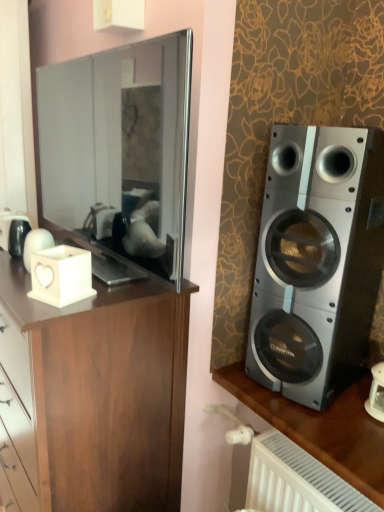
Question: From a real-world perspective, is matte black mirror at left under silver metallic speaker at right?

Choices:
 (A) yes
 (B) no

Answer: (B)

Question: Is matte black mirror at left thinner than silver metallic speaker at right?

Choices:
 (A) no
 (B) yes

Answer: (B)

Question: Considering the relative sizes of matte black mirror at left and silver metallic speaker at right in the image provided, is matte black mirror at left wider than silver metallic speaker at right?

Choices:
 (A) no
 (B) yes

Answer: (A)

Question: Is matte black mirror at left further to the viewer compared to silver metallic speaker at right?

Choices:
 (A) yes
 (B) no

Answer: (B)

Question: Can you confirm if matte black mirror at left is bigger than silver metallic speaker at right?

Choices:
 (A) no
 (B) yes

Answer: (B)

Question: From the image's perspective, relative to matte black mirror at left, is white matte candle holder at left above or below?

Choices:
 (A) above
 (B) below

Answer: (B)

Question: Considering their positions, is white matte candle holder at left located in front of or behind matte black mirror at left?

Choices:
 (A) front
 (B) behind

Answer: (B)

Question: Choose the correct answer: Is white matte candle holder at left inside matte black mirror at left or outside it?

Choices:
 (A) outside
 (B) inside

Answer: (A)

Question: Based on their positions, is white matte candle holder at left located to the left or right of matte black mirror at left?

Choices:
 (A) left
 (B) right

Answer: (A)

Question: Is brown wood cabinet at left inside the boundaries of matte black mirror at left, or outside?

Choices:
 (A) inside
 (B) outside

Answer: (B)

Question: From a real-world perspective, is brown wood cabinet at left above or below matte black mirror at left?

Choices:
 (A) below
 (B) above

Answer: (A)

Question: Is brown wood cabinet at left wider or thinner than matte black mirror at left?

Choices:
 (A) wide
 (B) thin

Answer: (A)

Question: Is brown wood cabinet at left in front of or behind matte black mirror at left in the image?

Choices:
 (A) behind
 (B) front

Answer: (A)

Question: Considering their positions, is matte black mirror at left located in front of or behind silver metallic speaker at right?

Choices:
 (A) front
 (B) behind

Answer: (A)

Question: Visually, is matte black mirror at left positioned to the left or to the right of silver metallic speaker at right?

Choices:
 (A) left
 (B) right

Answer: (A)